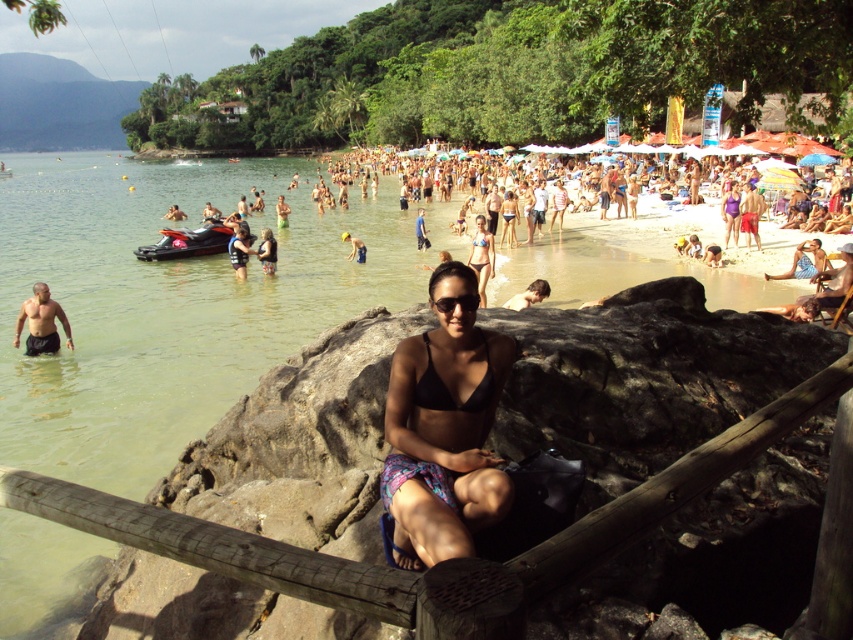
Does black bikini at center appear under blue bikini at center?

Indeed, black bikini at center is positioned under blue bikini at center.

Does black bikini at center lie behind blue bikini at center?

That is False.

Is point (415, 394) positioned after point (485, 225)?

No, it is in front of (485, 225).

Locate an element on the screen. black bikini at center is located at coordinates (444, 428).

How distant is black bikini at center from purple matte swimsuit at center?

black bikini at center and purple matte swimsuit at center are 19.33 meters apart from each other.

Is black bikini at center smaller than purple matte swimsuit at center?

No.

What do you see at coordinates (444, 428) in the screenshot?
I see `black bikini at center` at bounding box center [444, 428].

This screenshot has width=853, height=640. I want to click on black bikini at center, so click(444, 428).

Does blue life vest at center appear on the left side of smooth tan skin at center?

Correct, you'll find blue life vest at center to the left of smooth tan skin at center.

Is blue life vest at center closer to the viewer compared to smooth tan skin at center?

No, blue life vest at center is further to the viewer.

Find the location of `blue life vest at center`. blue life vest at center is located at coordinates pyautogui.click(x=239, y=252).